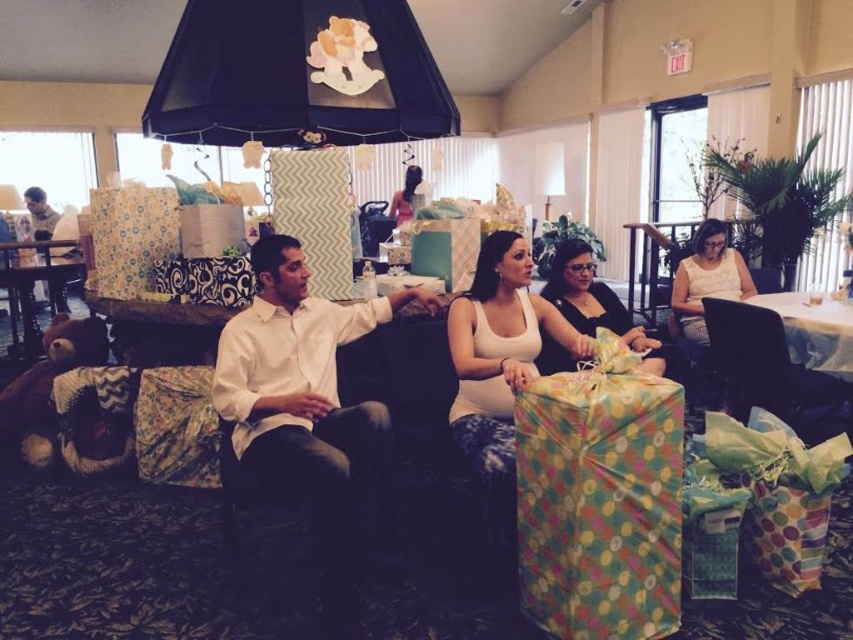
Based on the photo, between multicolored paper gift at center and matte pink dress at center, which one is positioned lower?

Positioned lower is multicolored paper gift at center.

Between multicolored paper gift at center and matte pink dress at center, which one is positioned higher?

matte pink dress at center

Is point (611, 378) farther from camera compared to point (397, 204)?

No, it is in front of (397, 204).

Where is `multicolored paper gift at center`? multicolored paper gift at center is located at coordinates (601, 504).

Is point (750, 344) positioned after point (532, 166)?

No, (750, 344) is in front of (532, 166).

Can you confirm if matte black armchair at lower right is positioned above white fabric lampshade at upper center?

Incorrect, matte black armchair at lower right is not positioned above white fabric lampshade at upper center.

Locate an element on the screen. The image size is (853, 640). matte black armchair at lower right is located at coordinates (772, 372).

Locate an element on the screen. The width and height of the screenshot is (853, 640). matte black armchair at lower right is located at coordinates (772, 372).

Does matte black dress at center appear on the left side of matte pink dress at center?

No, matte black dress at center is not to the left of matte pink dress at center.

Based on the photo, measure the distance from matte black dress at center to matte pink dress at center.

5.42 meters

The image size is (853, 640). Describe the element at coordinates (595, 301) in the screenshot. I see `matte black dress at center` at that location.

Find the location of a particular element. matte black dress at center is located at coordinates coord(595,301).